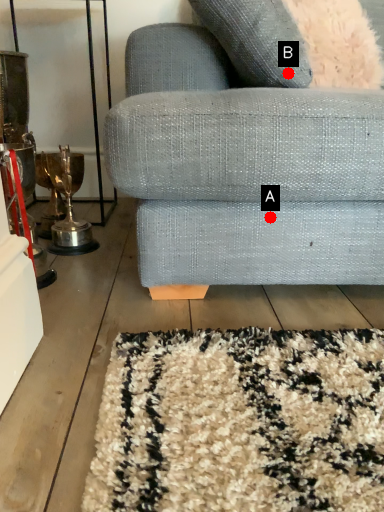
Question: Two points are circled on the image, labeled by A and B beside each circle. Among these points, which one is farthest from the camera?

Choices:
 (A) A is further
 (B) B is further

Answer: (A)